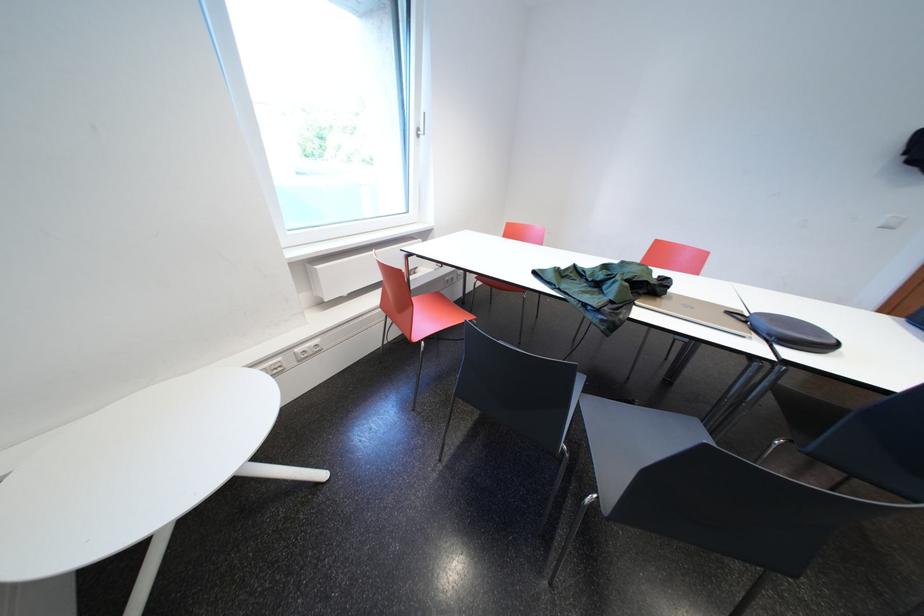
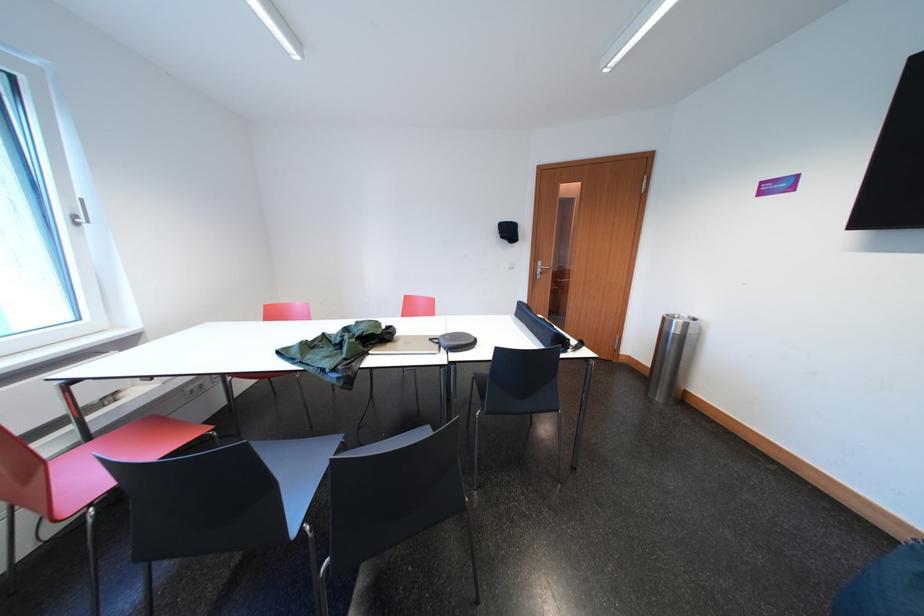
Find the pixel in the second image that matches [445,296] in the first image.

(161, 419)